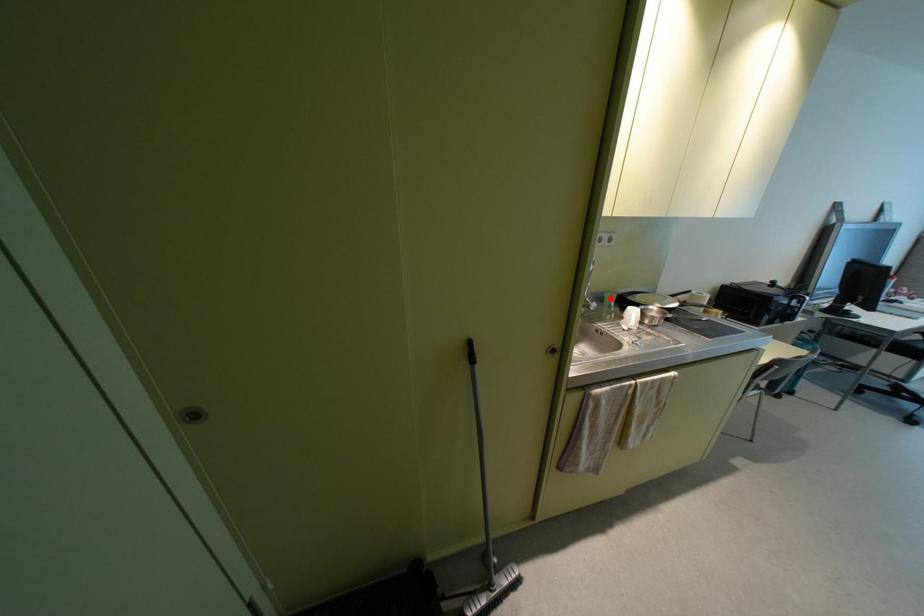
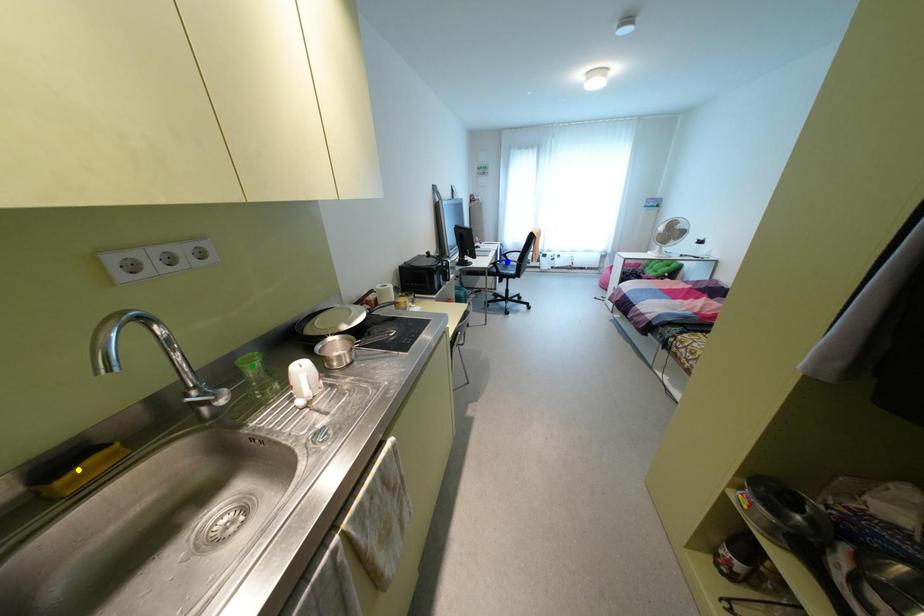
Question: I am providing you with two images of the same scene from different viewpoints. A red point is marked on the first image. You are given multiple points on the second image. Which mark in image 2 goes with the point in image 1?

Choices:
 (A) yellow point
 (B) blue point
 (C) green point

Answer: (C)